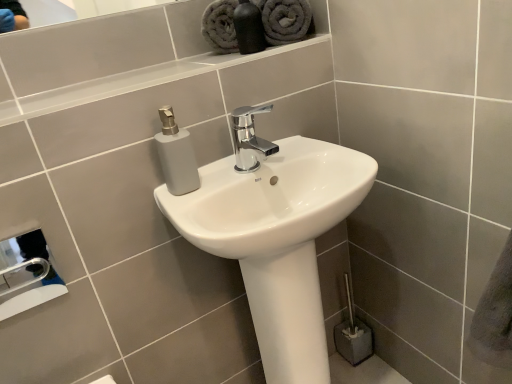
Question: Does metallic silver hand dryer at lower left touch matte black bottle at upper center?

Choices:
 (A) no
 (B) yes

Answer: (A)

Question: Is the depth of metallic silver hand dryer at lower left less than that of matte black bottle at upper center?

Choices:
 (A) yes
 (B) no

Answer: (A)

Question: Is there a large distance between metallic silver hand dryer at lower left and matte black bottle at upper center?

Choices:
 (A) no
 (B) yes

Answer: (A)

Question: Is metallic silver hand dryer at lower left thinner than matte black bottle at upper center?

Choices:
 (A) no
 (B) yes

Answer: (B)

Question: From a real-world perspective, is metallic silver hand dryer at lower left positioned under matte black bottle at upper center based on gravity?

Choices:
 (A) no
 (B) yes

Answer: (B)

Question: Is metallic silver hand dryer at lower left surrounding matte black bottle at upper center?

Choices:
 (A) yes
 (B) no

Answer: (B)

Question: Is gray plush towel at upper center, marked as the first bath towel in a right-to-left arrangement, at the right side of chrome metallic faucet at center?

Choices:
 (A) yes
 (B) no

Answer: (A)

Question: Does gray plush towel at upper center, marked as the first bath towel in a right-to-left arrangement, turn towards chrome metallic faucet at center?

Choices:
 (A) no
 (B) yes

Answer: (A)

Question: From a real-world perspective, is gray plush towel at upper center, which ranks as the second bath towel in left-to-right order, on top of chrome metallic faucet at center?

Choices:
 (A) no
 (B) yes

Answer: (B)

Question: Considering the relative sizes of gray plush towel at upper center, marked as the first bath towel in a right-to-left arrangement, and chrome metallic faucet at center in the image provided, is gray plush towel at upper center, marked as the first bath towel in a right-to-left arrangement, shorter than chrome metallic faucet at center?

Choices:
 (A) no
 (B) yes

Answer: (A)

Question: Is gray plush towel at upper center, which ranks as the second bath towel in left-to-right order, positioned with its back to chrome metallic faucet at center?

Choices:
 (A) no
 (B) yes

Answer: (A)

Question: Is gray plush towel at upper center, marked as the first bath towel in a right-to-left arrangement, positioned behind chrome metallic faucet at center?

Choices:
 (A) no
 (B) yes

Answer: (B)

Question: Is matte black bottle at upper center positioned in front of white glossy sink at center?

Choices:
 (A) no
 (B) yes

Answer: (A)